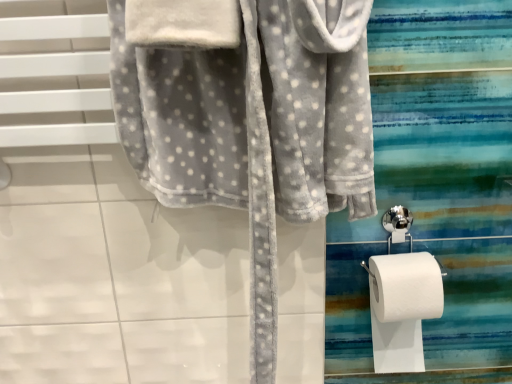
Question: Considering the relative positions of soft gray fleece robe at center and white paper at right in the image provided, is soft gray fleece robe at center to the right of white paper at right from the viewer's perspective?

Choices:
 (A) no
 (B) yes

Answer: (A)

Question: Can you confirm if soft gray fleece robe at center is smaller than white paper at right?

Choices:
 (A) yes
 (B) no

Answer: (B)

Question: Can you confirm if soft gray fleece robe at center is wider than white paper at right?

Choices:
 (A) yes
 (B) no

Answer: (B)

Question: From a real-world perspective, is soft gray fleece robe at center below white paper at right?

Choices:
 (A) yes
 (B) no

Answer: (B)

Question: From a real-world perspective, is soft gray fleece robe at center located higher than white paper at right?

Choices:
 (A) no
 (B) yes

Answer: (B)

Question: Is soft gray fleece robe at center completely or partially outside of white paper at right?

Choices:
 (A) yes
 (B) no

Answer: (A)

Question: Is white paper at right completely or partially outside of soft gray fleece robe at center?

Choices:
 (A) no
 (B) yes

Answer: (B)

Question: Considering the relative sizes of white paper at right and soft gray fleece robe at center in the image provided, is white paper at right shorter than soft gray fleece robe at center?

Choices:
 (A) no
 (B) yes

Answer: (B)

Question: Would you say soft gray fleece robe at center is part of white paper at right's contents?

Choices:
 (A) no
 (B) yes

Answer: (A)

Question: Is white paper at right bigger than soft gray fleece robe at center?

Choices:
 (A) no
 (B) yes

Answer: (A)

Question: Is white paper at right aimed at soft gray fleece robe at center?

Choices:
 (A) no
 (B) yes

Answer: (A)

Question: Is soft gray fleece robe at center at the back of white paper at right?

Choices:
 (A) yes
 (B) no

Answer: (B)

Question: Based on their sizes in the image, would you say soft gray fleece robe at center is bigger or smaller than white paper at right?

Choices:
 (A) big
 (B) small

Answer: (A)